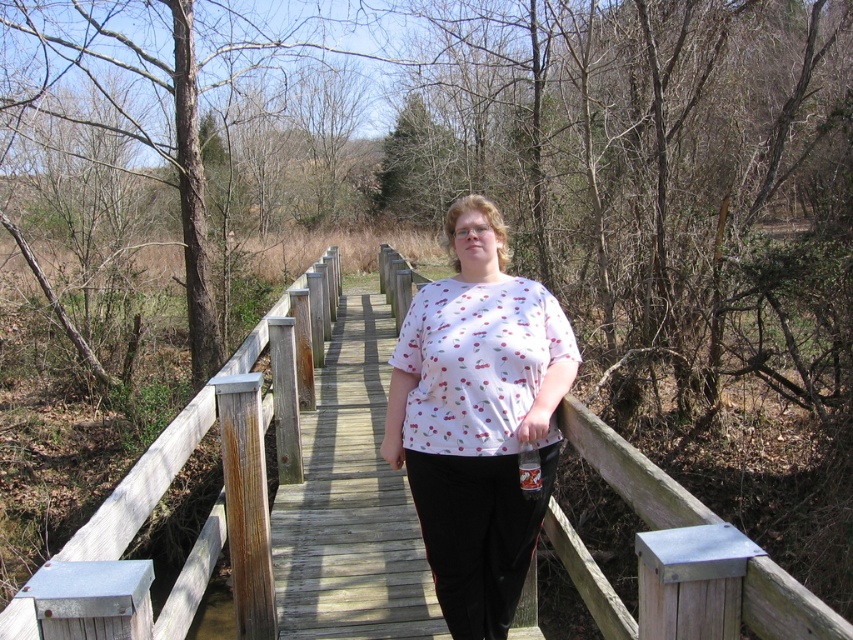
Question: Estimate the real-world distances between objects in this image. Which object is closer to the wooden fence at center?

Choices:
 (A) wooden bridge at center
 (B) white printed shirt at center

Answer: (B)

Question: Which object is farther from the camera taking this photo?

Choices:
 (A) wooden fence at center
 (B) wooden bridge at center
 (C) white printed shirt at center

Answer: (A)

Question: Is white printed shirt at center to the right of wooden fence at center from the viewer's perspective?

Choices:
 (A) yes
 (B) no

Answer: (A)

Question: Which point appears closest to the camera in this image?

Choices:
 (A) (625, 451)
 (B) (347, 419)
 (C) (440, 440)

Answer: (A)

Question: Does wooden bridge at center have a smaller size compared to wooden fence at center?

Choices:
 (A) no
 (B) yes

Answer: (A)

Question: Is white printed shirt at center to the right of wooden fence at center from the viewer's perspective?

Choices:
 (A) no
 (B) yes

Answer: (B)